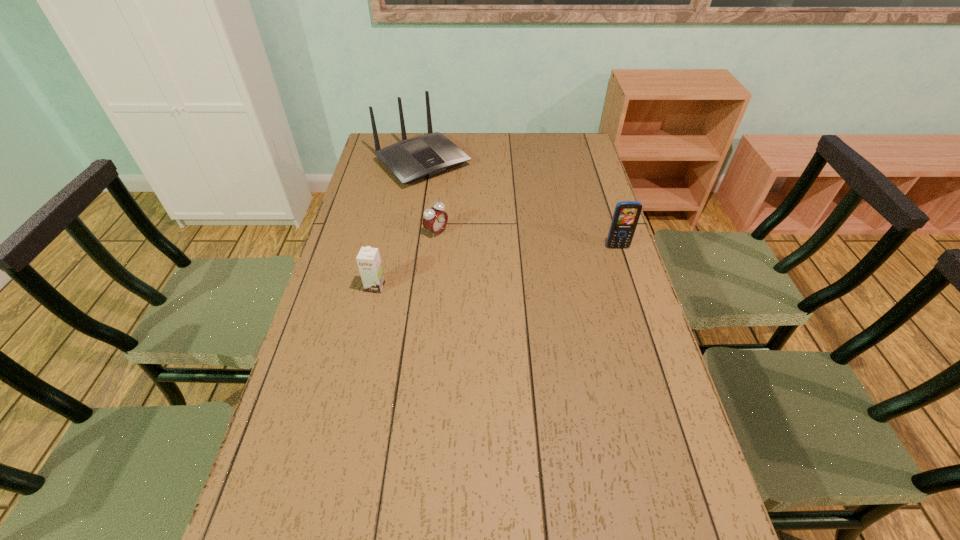
This screenshot has height=540, width=960. I want to click on unoccupied area between the cellular telephone and the chocolate milk, so click(496, 267).

Where is `unoccupied position between the alarm clock and the second nearest object`? This screenshot has width=960, height=540. unoccupied position between the alarm clock and the second nearest object is located at coordinates pyautogui.click(x=527, y=239).

This screenshot has width=960, height=540. Find the location of `empty space between the alarm clock and the second shortest object`. empty space between the alarm clock and the second shortest object is located at coordinates (406, 259).

This screenshot has height=540, width=960. I want to click on vacant space that's between the shortest object and the cellular telephone, so coord(527,239).

The height and width of the screenshot is (540, 960). I want to click on free space between the shortest object and the second tallest object, so click(x=527, y=239).

Where is `vacant space that's between the cellular telephone and the farthest object`? vacant space that's between the cellular telephone and the farthest object is located at coordinates (520, 205).

Locate an element on the screen. The width and height of the screenshot is (960, 540). free space between the farthest object and the nearest object is located at coordinates (399, 225).

Identify the location of free space between the second tallest object and the tallest object. (520, 205).

In order to click on object that ranks as the third closest to the tallest object in this screenshot , I will do `click(626, 214)`.

Find the location of `object that is the closest to the second nearest object`. object that is the closest to the second nearest object is located at coordinates (435, 219).